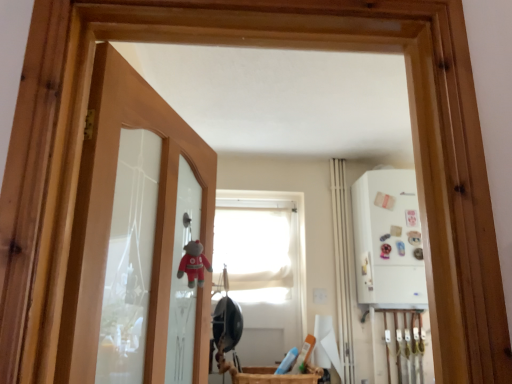
Question: Considering the positions of point (345, 359) and point (265, 248), is point (345, 359) closer or farther from the camera than point (265, 248)?

Choices:
 (A) farther
 (B) closer

Answer: (B)

Question: Considering the positions of white fabric curtain at center-right and white matte window at center in the image, is white fabric curtain at center-right taller or shorter than white matte window at center?

Choices:
 (A) short
 (B) tall

Answer: (B)

Question: Estimate the real-world distances between objects in this image. Which object is closer to the white glossy medicine cabinet at right?

Choices:
 (A) white fabric curtain at center-right
 (B) translucent glass door at left
 (C) white matte window at center
 (D) wooden basket at lower center

Answer: (A)

Question: Estimate the real-world distances between objects in this image. Which object is farther from the wooden basket at lower center?

Choices:
 (A) white glossy medicine cabinet at right
 (B) white matte window at center
 (C) translucent glass door at left
 (D) white fabric curtain at center-right

Answer: (C)